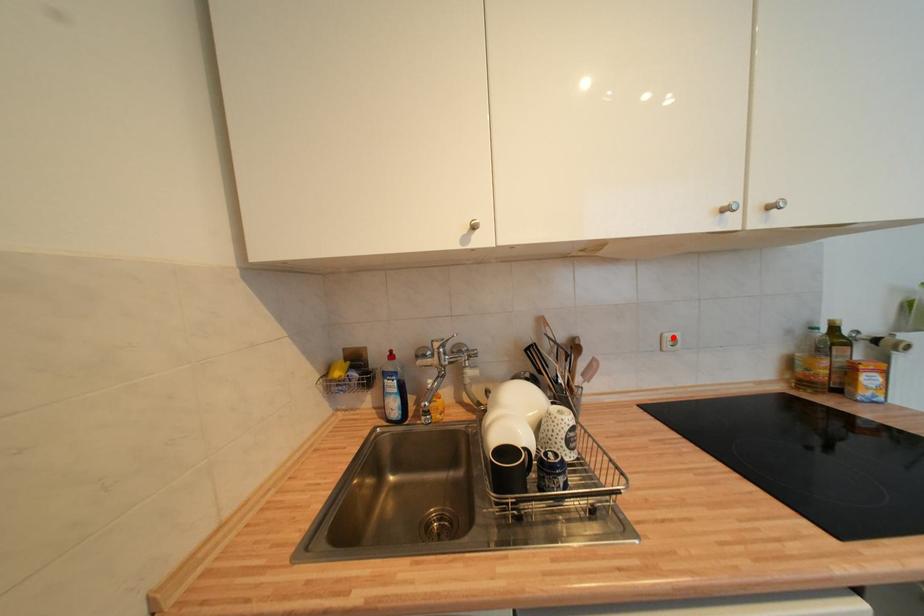
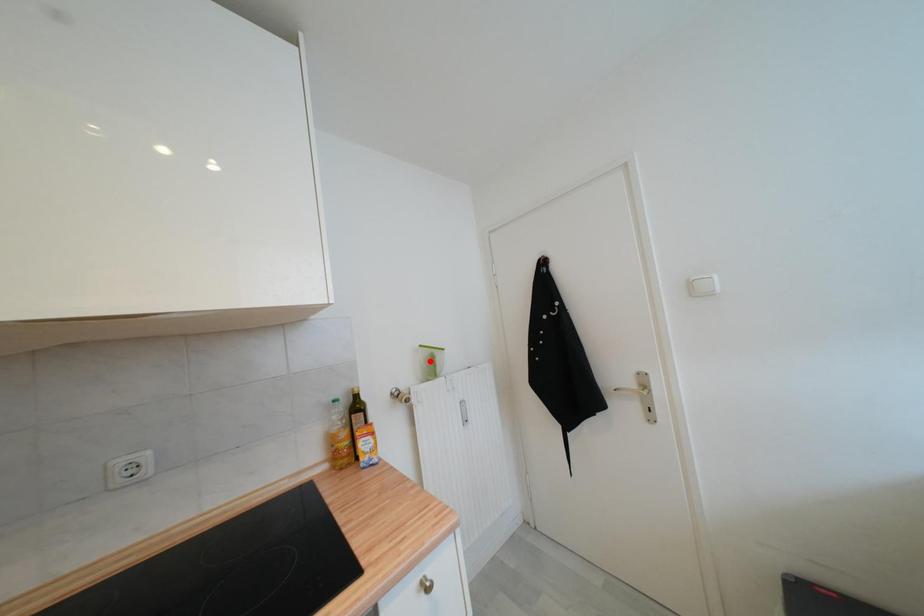
I am providing you with two images of the same scene from different viewpoints. A red point is marked on the first image and another point is marked on the second image. Does the point marked in image1 correspond to the same location as the one in image2?

No